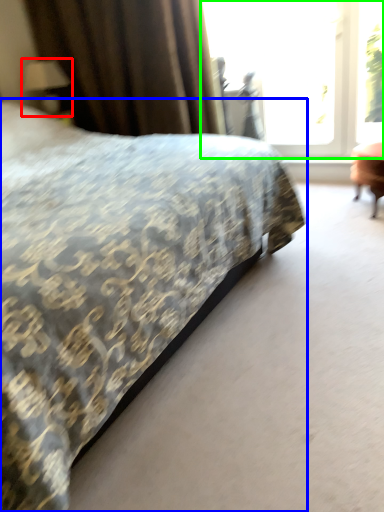
Question: Which object is the farthest from table lamp (highlighted by a red box)? Choose among these: bed (highlighted by a blue box) or window (highlighted by a green box).

Choices:
 (A) bed
 (B) window

Answer: (A)